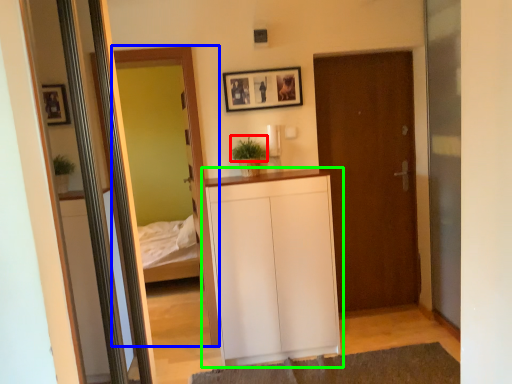
Question: Which is nearer to the plant (highlighted by a red box)? mirror (highlighted by a blue box) or cabinetry (highlighted by a green box).

Choices:
 (A) mirror
 (B) cabinetry

Answer: (A)